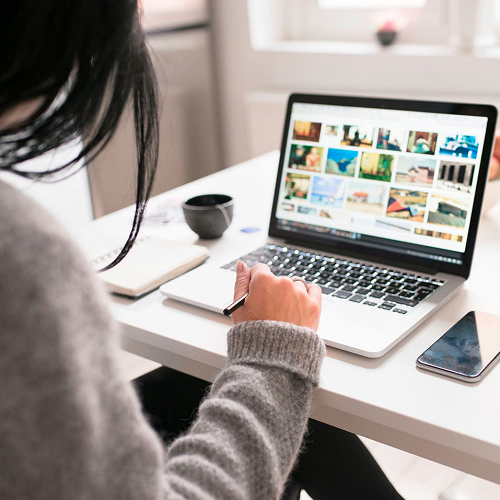
The height and width of the screenshot is (500, 500). In order to click on desk in this screenshot , I will do `click(402, 405)`.